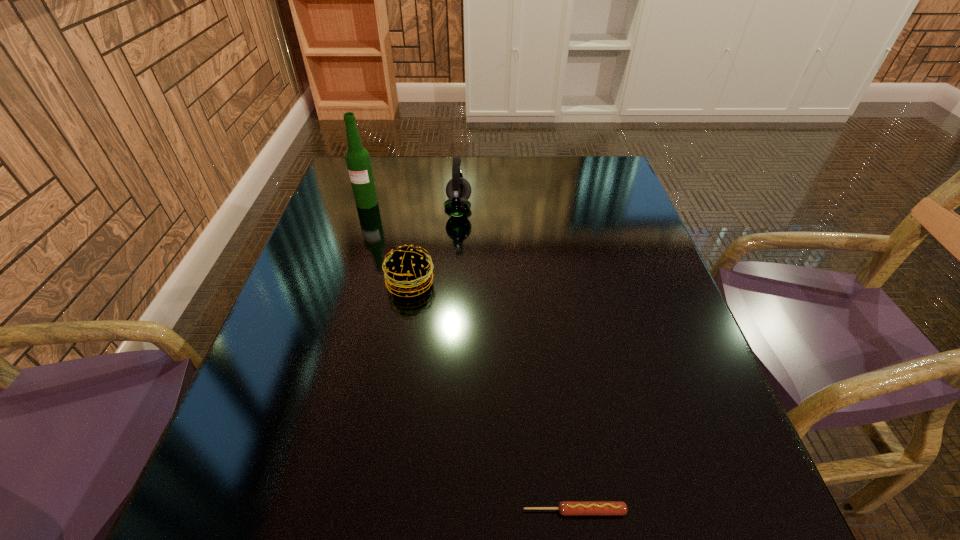
You are a GUI agent. You are given a task and a screenshot of the screen. Output one action in this format:
    pyautogui.click(x=<x>, y=<y>)
    Task: Click on the tallest object
    
    Given the screenshot: What is the action you would take?
    pyautogui.click(x=357, y=158)

Identify the location of beer bottle. The height and width of the screenshot is (540, 960). (357, 158).

Where is `the third shortest object`? This screenshot has height=540, width=960. the third shortest object is located at coordinates (458, 190).

Identify the location of the second object from right to left. (458, 190).

Image resolution: width=960 pixels, height=540 pixels. In order to click on patty in this screenshot , I will do `click(408, 270)`.

The height and width of the screenshot is (540, 960). What are the coordinates of `the second shortest object` in the screenshot? It's located at (408, 270).

This screenshot has width=960, height=540. Identify the location of the nearest object. (566, 508).

I want to click on the shortest object, so click(566, 508).

Find the location of a particular element. This screenshot has height=540, width=960. free space located on the label of the leftmost object is located at coordinates (355, 239).

Locate an element on the screen. vacant position located on the ear cups of the second tallest object is located at coordinates (616, 209).